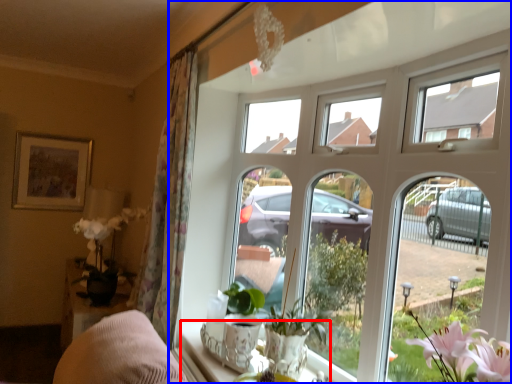
Question: Which point is further to the camera, window sill (highlighted by a red box) or window (highlighted by a blue box)?

Choices:
 (A) window sill
 (B) window

Answer: (A)